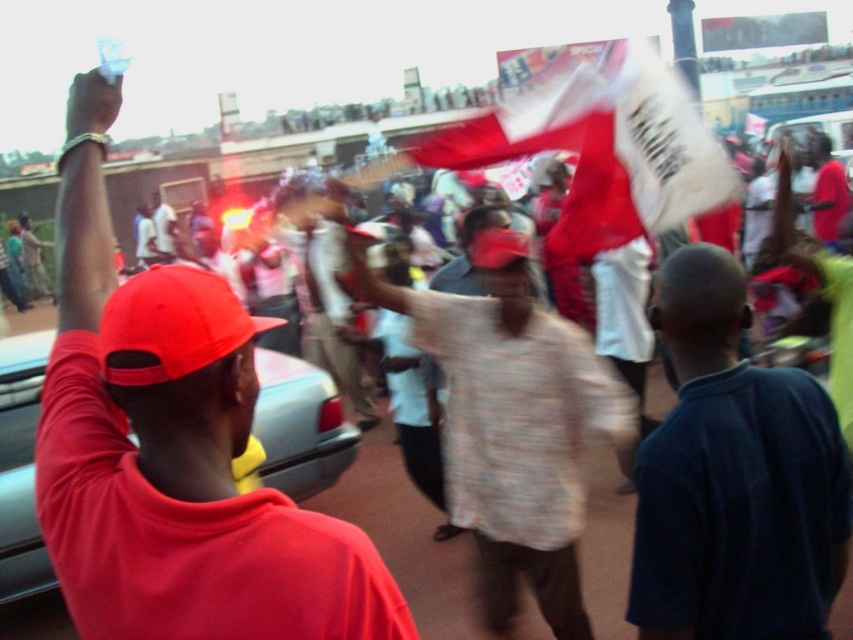
You are a photographer standing in the crowd and want to take a photo of the light brown textured shirt at center without the matte red cap at left blocking it. What should you do?

The matte red cap at left is in front of the light brown textured shirt at center. To avoid the cap blocking the shirt, move to the side so that the cap is no longer between you and the shirt.

You are a photographer trying to capture a clear shot of both the matte red cap at left and the matte red baseball cap at left in the scene. Given their sizes, which one should you focus on first to ensure it fits within your camera frame?

The matte red cap at left has a larger size compared to the matte red baseball cap at left, so you should focus on the matte red cap at left first to ensure it fits within your camera frame.

You are a photographer taking a picture of the crowd in the scene. You notice a specific point at coordinates (173, 449). What object is located at this point?

The point at coordinates (173, 449) indicates the matte red cap at left.